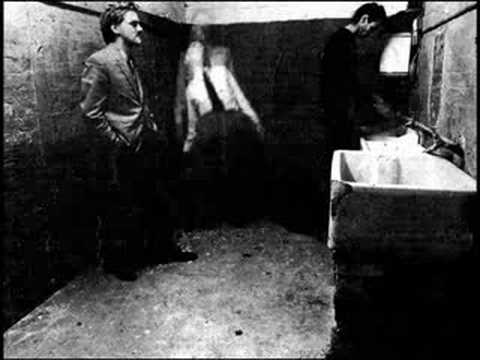
Identify the location of sink. (446, 176).